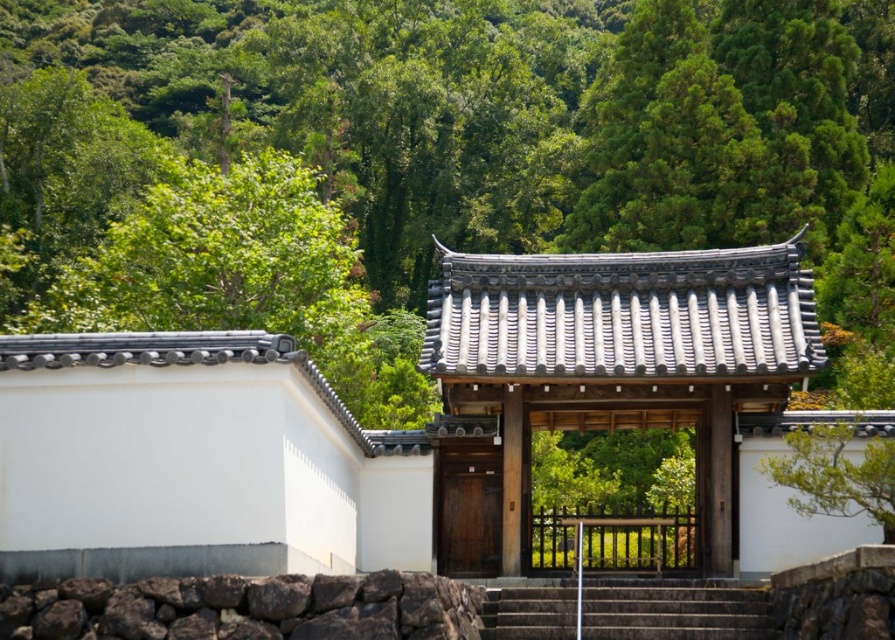
Can you confirm if dark brown rough stone at lower center is shorter than dark gray stone stairs at center?

No.

Does point (239, 600) lie behind point (589, 595)?

No, it is not.

At what (x,y) coordinates should I click in order to perform the action: click on dark brown rough stone at lower center. Please return your answer as a coordinate pair (x, y). The height and width of the screenshot is (640, 895). Looking at the image, I should click on (246, 609).

I want to click on dark gray stone stairs at center, so click(674, 609).

Between point (501, 602) and point (499, 493), which one is positioned in front?

Point (501, 602) is more forward.

Does point (618, 634) lie behind point (497, 522)?

That is False.

Locate an element on the screen. dark gray stone stairs at center is located at coordinates (674, 609).

Can you confirm if dark brown rough stone at lower center is positioned below wooden door at center?

Correct, dark brown rough stone at lower center is located below wooden door at center.

Describe the element at coordinates (246, 609) in the screenshot. I see `dark brown rough stone at lower center` at that location.

Is point (33, 595) more distant than point (486, 451)?

No, it is not.

Image resolution: width=895 pixels, height=640 pixels. I want to click on dark brown rough stone at lower center, so click(246, 609).